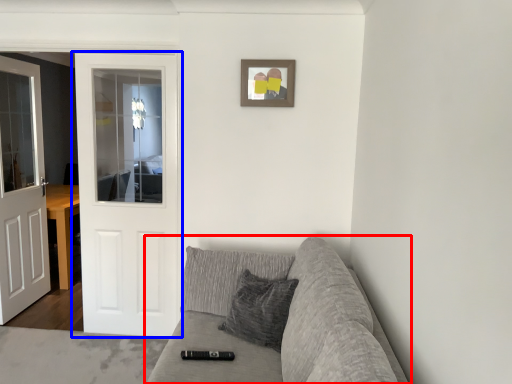
Question: Which object is closer to the camera taking this photo, studio couch (highlighted by a red box) or door (highlighted by a blue box)?

Choices:
 (A) studio couch
 (B) door

Answer: (A)